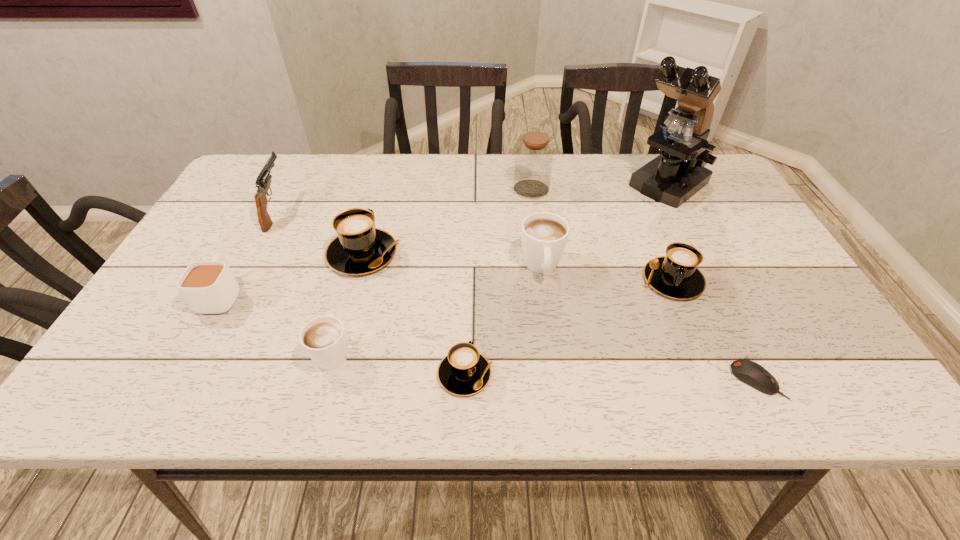
Image resolution: width=960 pixels, height=540 pixels. Identify the location of vacant space located 0.050m with the handle on the side of the right white cappuccino. (547, 305).

The width and height of the screenshot is (960, 540). I want to click on vacant space located 0.220m on the left of the biggest black cappuccino, so click(x=239, y=254).

Identify the location of vacant position located on the side with the handle of the cup. The width and height of the screenshot is (960, 540). (277, 193).

You are a GUI agent. You are given a task and a screenshot of the screen. Output one action in this format:
    pyautogui.click(x=<x>, y=<y>)
    Task: Click on the vacant point located 0.360m on the side with the handle of the cup
    The height and width of the screenshot is (540, 960).
    Given the screenshot: What is the action you would take?
    pyautogui.click(x=281, y=187)

Locate an element on the screen. vacant space located 0.060m on the side with the handle of the cup is located at coordinates (243, 256).

Identify the location of vacant point located on the front of the second smallest black cappuccino. The width and height of the screenshot is (960, 540). (712, 376).

Identify the location of vacant space situated with the handle on the side of the smaller white cappuccino. (372, 214).

Image resolution: width=960 pixels, height=540 pixels. What are the coordinates of `vacant space situated with the handle on the side of the smaller white cappuccino` in the screenshot? It's located at (349, 296).

Where is `free point located with the handle on the side of the smaller white cappuccino`? The height and width of the screenshot is (540, 960). free point located with the handle on the side of the smaller white cappuccino is located at coordinates (360, 256).

Identify the location of vacant region located 0.130m on the left of the third cappuccino from right to left. The image size is (960, 540). (372, 374).